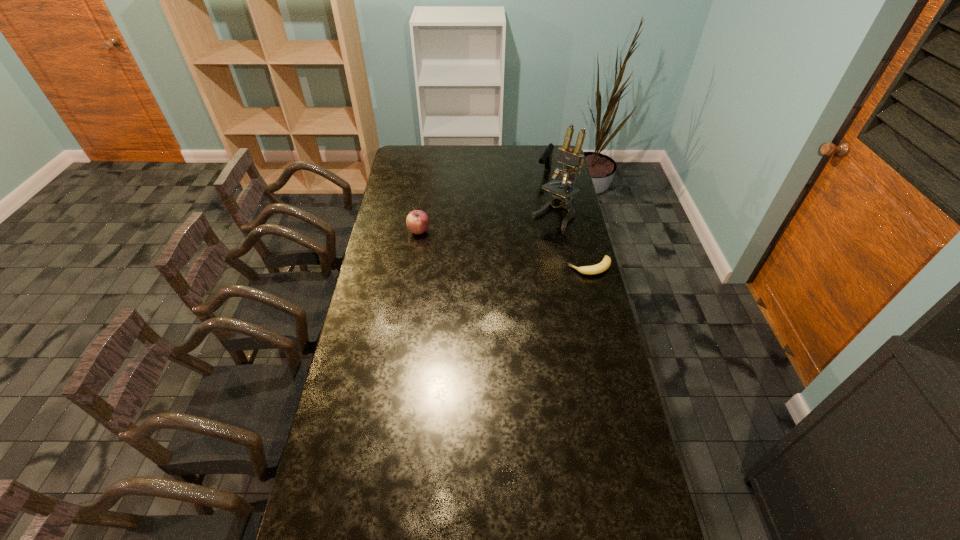
This screenshot has width=960, height=540. Find the location of `free space between the microscope and the leftmost object`. free space between the microscope and the leftmost object is located at coordinates (487, 223).

Image resolution: width=960 pixels, height=540 pixels. I want to click on vacant point located between the second tallest object and the leftmost object, so click(482, 202).

The height and width of the screenshot is (540, 960). What are the coordinates of `vacant area that lies between the microscope and the apple` in the screenshot? It's located at (487, 223).

Identify the location of free space between the pistol and the third tallest object. Image resolution: width=960 pixels, height=540 pixels. (482, 202).

Image resolution: width=960 pixels, height=540 pixels. Find the location of `free spot between the leftmost object and the banana`. free spot between the leftmost object and the banana is located at coordinates (504, 249).

Where is `object that is the third closest to the third tallest object`? This screenshot has width=960, height=540. object that is the third closest to the third tallest object is located at coordinates (546, 158).

Where is `the second closest object to the pistol`? The height and width of the screenshot is (540, 960). the second closest object to the pistol is located at coordinates (606, 262).

At what (x,y) coordinates should I click in order to perform the action: click on vacant region that satisfies the following two spatial constraints: 1. on the back side of the apple; 2. on the right side of the farthest object. Please return your answer as a coordinate pair (x, y). Image resolution: width=960 pixels, height=540 pixels. Looking at the image, I should click on (427, 173).

Image resolution: width=960 pixels, height=540 pixels. Identify the location of free space in the image that satisfies the following two spatial constraints: 1. on the front side of the farthest object; 2. on the right side of the microscope. (552, 215).

Locate an element on the screen. vacant space that satisfies the following two spatial constraints: 1. on the front side of the microscope; 2. on the right side of the farthest object is located at coordinates (552, 215).